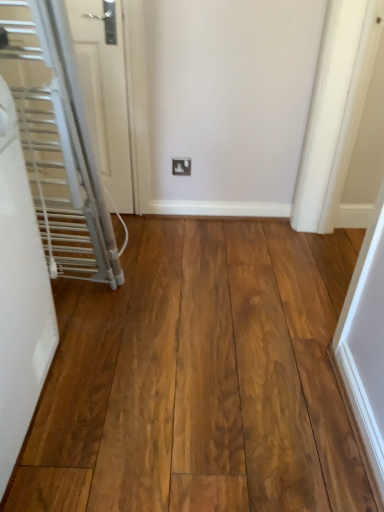
Locate an element on the screen. This screenshot has height=512, width=384. empty space that is ontop of natural wood flooring at center (from a real-world perspective) is located at coordinates (192, 327).